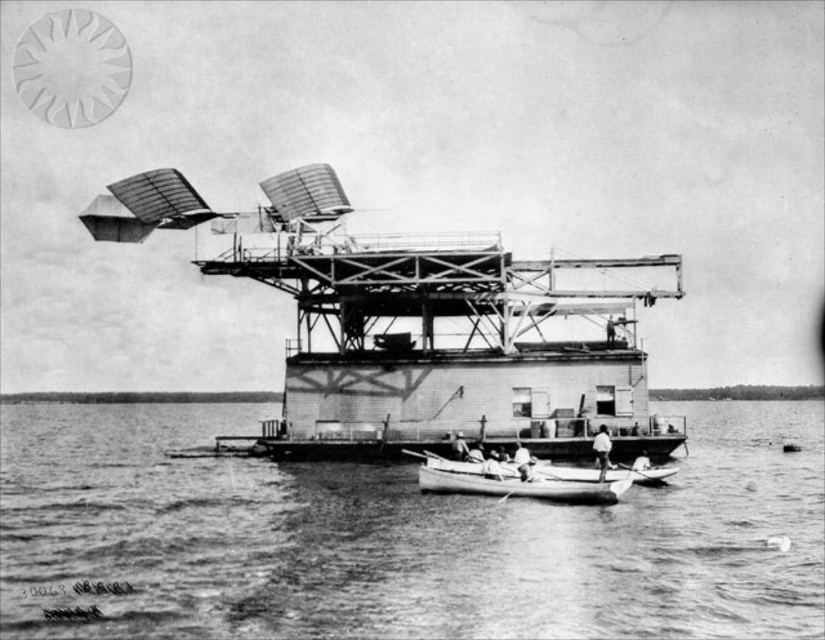
Question: Which object appears closest to the camera in this image?

Choices:
 (A) smooth white canoe at center
 (B) smooth water at center

Answer: (B)

Question: Among these objects, which one is farthest from the camera?

Choices:
 (A) smooth water at center
 (B) smooth white canoe at center

Answer: (B)

Question: Can you confirm if smooth water at center is wider than smooth white canoe at center?

Choices:
 (A) yes
 (B) no

Answer: (A)

Question: Does smooth water at center have a smaller size compared to smooth white canoe at center?

Choices:
 (A) no
 (B) yes

Answer: (A)

Question: Does smooth water at center have a lesser width compared to smooth white canoe at center?

Choices:
 (A) no
 (B) yes

Answer: (A)

Question: Which point is closer to the camera taking this photo?

Choices:
 (A) (547, 486)
 (B) (517, 604)

Answer: (B)